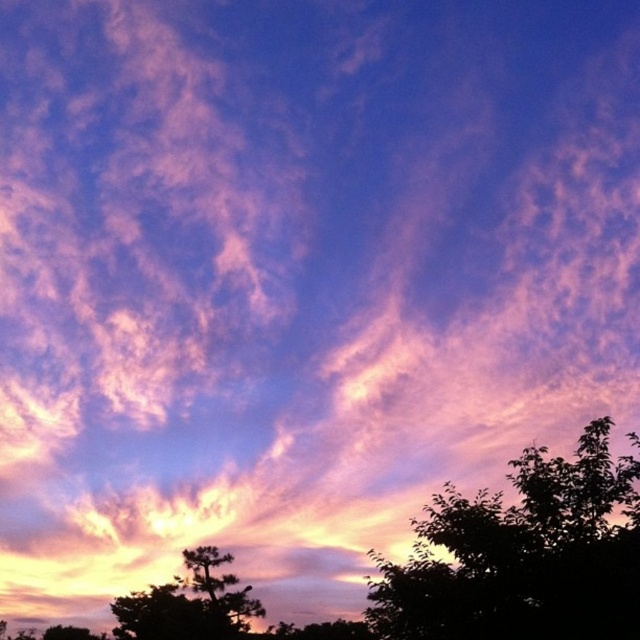
Between silhouette leafy tree at lower right and silhouette pine tree at lower left, which one is positioned higher?

silhouette leafy tree at lower right

This screenshot has width=640, height=640. What do you see at coordinates (524, 556) in the screenshot?
I see `silhouette leafy tree at lower right` at bounding box center [524, 556].

Locate an element on the screen. This screenshot has width=640, height=640. silhouette leafy tree at lower right is located at coordinates (524, 556).